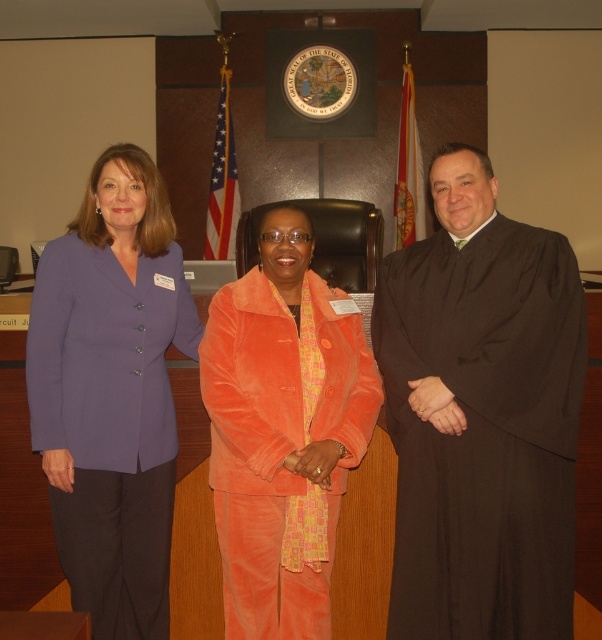
Which is more to the right, black matte robe at right or velvet orange suit at center?

black matte robe at right

Does point (435, 632) come closer to viewer compared to point (199, 348)?

No.

Where is `black matte robe at right`? black matte robe at right is located at coordinates (483, 429).

Can you confirm if matte purple blazer at left is wider than velvet orange suit at center?

Incorrect, matte purple blazer at left's width does not surpass velvet orange suit at center's.

Which of these two, matte purple blazer at left or velvet orange suit at center, stands taller?

With more height is matte purple blazer at left.

Does point (57, 440) come in front of point (344, 328)?

Yes, point (57, 440) is closer to viewer.

I want to click on matte purple blazer at left, so click(x=111, y=392).

Does black matte robe at right have a greater width compared to matte purple blazer at left?

Correct, the width of black matte robe at right exceeds that of matte purple blazer at left.

This screenshot has height=640, width=602. What do you see at coordinates (483, 429) in the screenshot?
I see `black matte robe at right` at bounding box center [483, 429].

Which is behind, point (412, 424) or point (175, 300)?

Positioned behind is point (175, 300).

The image size is (602, 640). I want to click on black matte robe at right, so click(x=483, y=429).